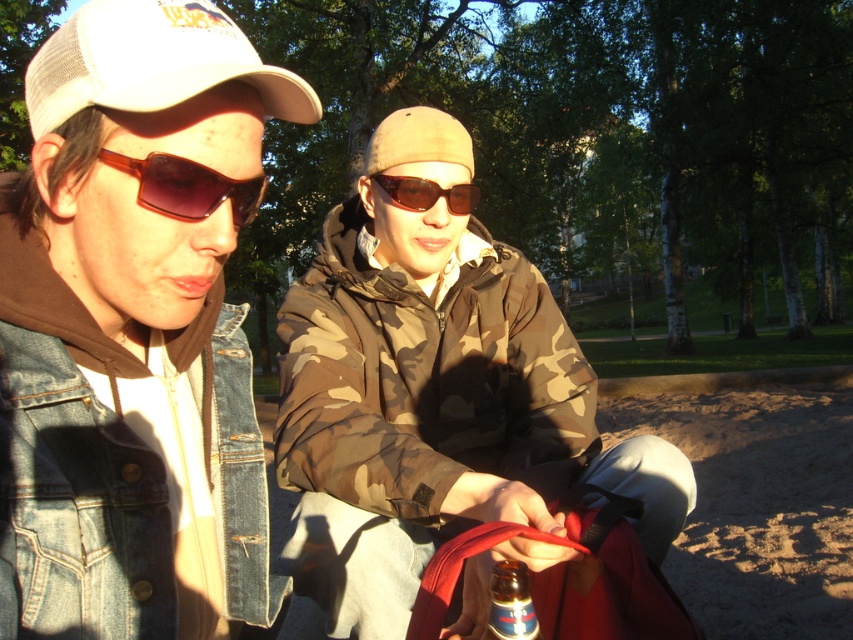
You are trying to decide which item to pick up first from the scene described. The brown matte sunglasses at left and the metallic silver bottle at center are both within reach. Based on their sizes, which item would require more space to hold?

The brown matte sunglasses at left is bigger than the metallic silver bottle at center, so it would require more space to hold.

You are a photographer trying to capture a clear shot of both the camo jacket at center and the white mesh baseball cap at upper left in the scene. Given their positions and sizes, which object should you focus on first to ensure it is in sharp focus?

The camo jacket at center should be focused on first since it has a greater height compared to the white mesh baseball cap at upper left, making it more prominent in the frame.